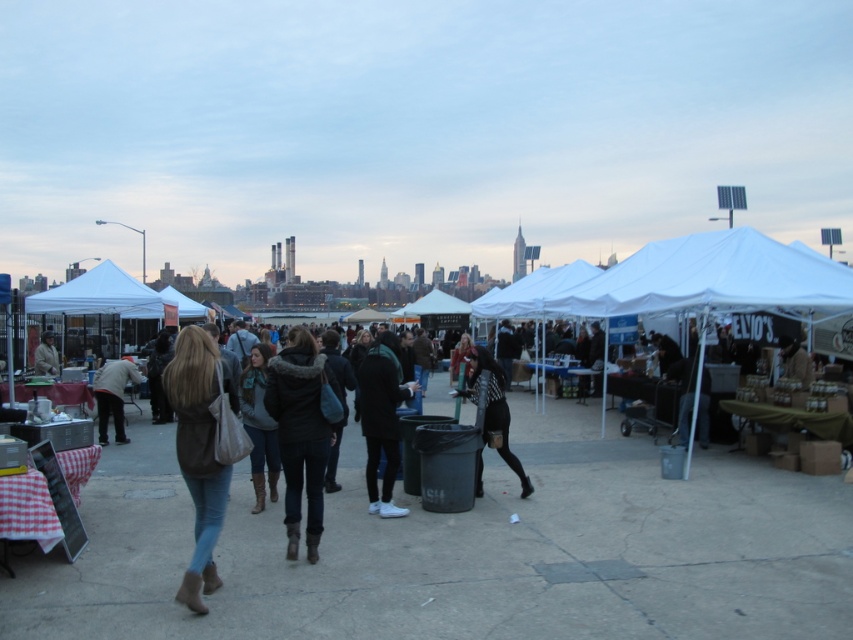
Is dark green jacket at center to the right of leather jacket at left from the viewer's perspective?

Correct, you'll find dark green jacket at center to the right of leather jacket at left.

Who is more forward, [390,412] or [56,371]?

Positioned in front is point [390,412].

Locate an element on the screen. This screenshot has width=853, height=640. dark green jacket at center is located at coordinates (381, 419).

Does matte brown jacket at center have a lesser width compared to dark brown leather jacket at left?

In fact, matte brown jacket at center might be wider than dark brown leather jacket at left.

Who is positioned more to the left, matte brown jacket at center or dark brown leather jacket at left?

dark brown leather jacket at left is more to the left.

You are a GUI agent. You are given a task and a screenshot of the screen. Output one action in this format:
    pyautogui.click(x=<x>, y=<y>)
    Task: Click on the matte brown jacket at center
    
    Given the screenshot: What is the action you would take?
    pyautogui.click(x=196, y=456)

Locate an element on the screen. This screenshot has width=853, height=640. matte brown jacket at center is located at coordinates (196, 456).

Who is more distant from viewer, (648, 244) or (49, 356)?

The point (49, 356) is more distant.

Does white fabric canopy at center come behind leather jacket at left?

No, it is in front of leather jacket at left.

Where is `white fabric canopy at center`? white fabric canopy at center is located at coordinates (712, 278).